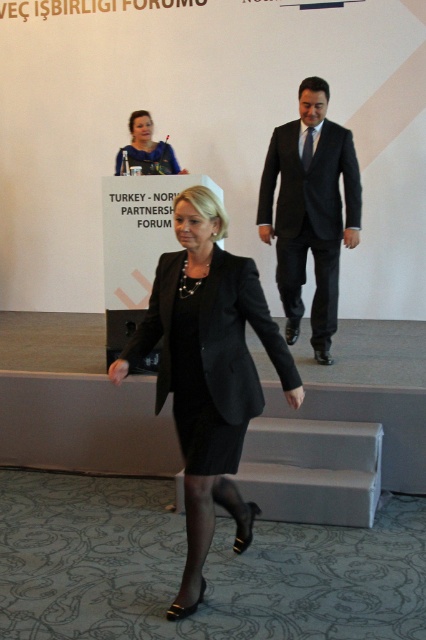
Is point (176, 234) positioned in front of point (155, 156)?

That is True.

Which of these two, black matte blazer at center or matte black dress at center, stands taller?

black matte blazer at center

What do you see at coordinates (207, 371) in the screenshot?
I see `black matte blazer at center` at bounding box center [207, 371].

Image resolution: width=426 pixels, height=640 pixels. I want to click on black matte blazer at center, so click(x=207, y=371).

Can you confirm if black matte blazer at center is shorter than black suit at center?

Yes.

Can you confirm if black matte blazer at center is taller than black suit at center?

Incorrect, black matte blazer at center's height is not larger of black suit at center's.

Locate an element on the screen. Image resolution: width=426 pixels, height=640 pixels. black matte blazer at center is located at coordinates (207, 371).

Locate an element on the screen. The height and width of the screenshot is (640, 426). black matte blazer at center is located at coordinates (207, 371).

Who is taller, black fabric pants at center or matte black dress at center?

Standing taller between the two is black fabric pants at center.

Is black fabric pants at center shorter than matte black dress at center?

No.

The height and width of the screenshot is (640, 426). What do you see at coordinates (305, 282) in the screenshot?
I see `black fabric pants at center` at bounding box center [305, 282].

This screenshot has width=426, height=640. Find the location of `black fabric pants at center`. black fabric pants at center is located at coordinates (305, 282).